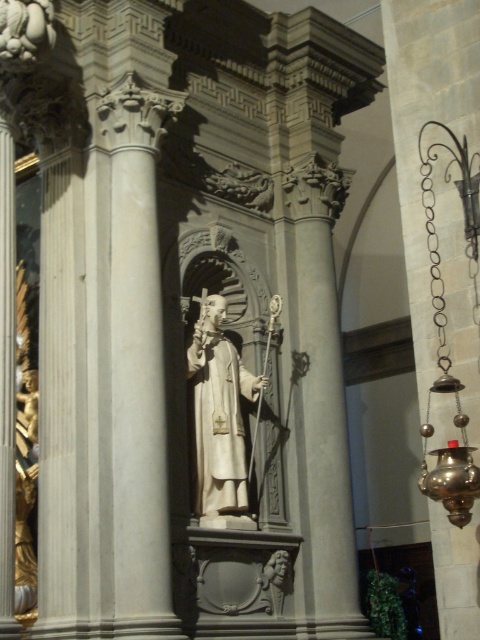
Question: Which point appears farthest from the camera in this image?

Choices:
 (A) (416, 20)
 (B) (217, 410)

Answer: (B)

Question: Does polished brass candle holder at right have a lesser width compared to white marble statue at center?

Choices:
 (A) no
 (B) yes

Answer: (A)

Question: Does polished brass candle holder at right have a lesser width compared to white marble statue at center?

Choices:
 (A) no
 (B) yes

Answer: (A)

Question: Does polished brass candle holder at right lie in front of white marble statue at center?

Choices:
 (A) yes
 (B) no

Answer: (A)

Question: Which of the following is the farthest from the observer?

Choices:
 (A) white marble statue at center
 (B) polished brass candle holder at right

Answer: (A)

Question: Which point is closer to the camera?

Choices:
 (A) (200, 394)
 (B) (437, 220)

Answer: (B)